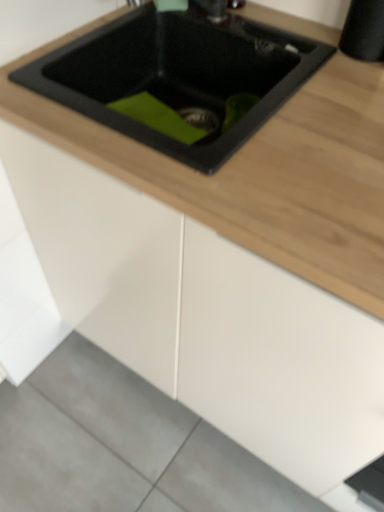
Question: Is black matte sink at upper center wider or thinner than gray concrete at lower left?

Choices:
 (A) wide
 (B) thin

Answer: (B)

Question: From a real-world perspective, is black matte sink at upper center above or below gray concrete at lower left?

Choices:
 (A) above
 (B) below

Answer: (A)

Question: From the image's perspective, is black matte sink at upper center positioned above or below gray concrete at lower left?

Choices:
 (A) below
 (B) above

Answer: (B)

Question: Considering the positions of point (183, 477) and point (167, 50), is point (183, 477) closer or farther from the camera than point (167, 50)?

Choices:
 (A) closer
 (B) farther

Answer: (B)

Question: In the image, is gray concrete at lower left positioned in front of or behind black matte sink at upper center?

Choices:
 (A) front
 (B) behind

Answer: (B)

Question: Would you say gray concrete at lower left is to the left or to the right of black matte sink at upper center in the picture?

Choices:
 (A) right
 (B) left

Answer: (B)

Question: Is gray concrete at lower left inside or outside of black matte sink at upper center?

Choices:
 (A) inside
 (B) outside

Answer: (B)